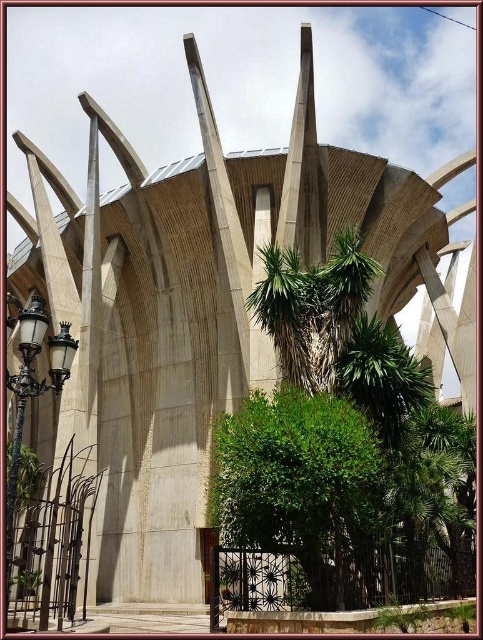
Question: Which point is closer to the camera?

Choices:
 (A) green leafy bush at center
 (B) polished brass streetlight at lower left

Answer: (B)

Question: Is green leafy tree at center smaller than green leafy bush at center?

Choices:
 (A) yes
 (B) no

Answer: (B)

Question: Estimate the real-world distances between objects in this image. Which object is closer to the green leafy bush at center?

Choices:
 (A) green leafy tree at center
 (B) polished brass streetlight at lower left

Answer: (A)

Question: Does green leafy bush at center appear on the left side of polished brass streetlight at lower left?

Choices:
 (A) yes
 (B) no

Answer: (B)

Question: Considering the real-world distances, which object is closest to the green leafy tree at center?

Choices:
 (A) green leafy bush at center
 (B) polished brass streetlight at lower left

Answer: (A)

Question: Does green leafy tree at center appear over green leafy bush at center?

Choices:
 (A) yes
 (B) no

Answer: (A)